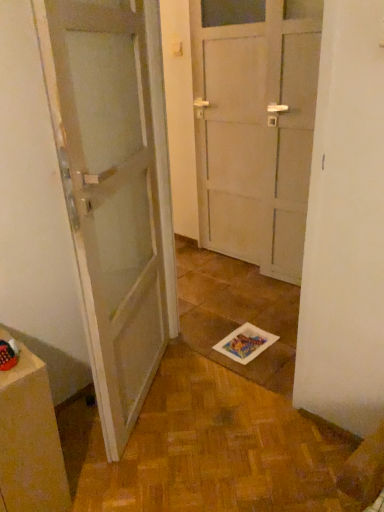
Locate an element on the screen. The width and height of the screenshot is (384, 512). vacant space to the right of white glossy door at left is located at coordinates (228, 410).